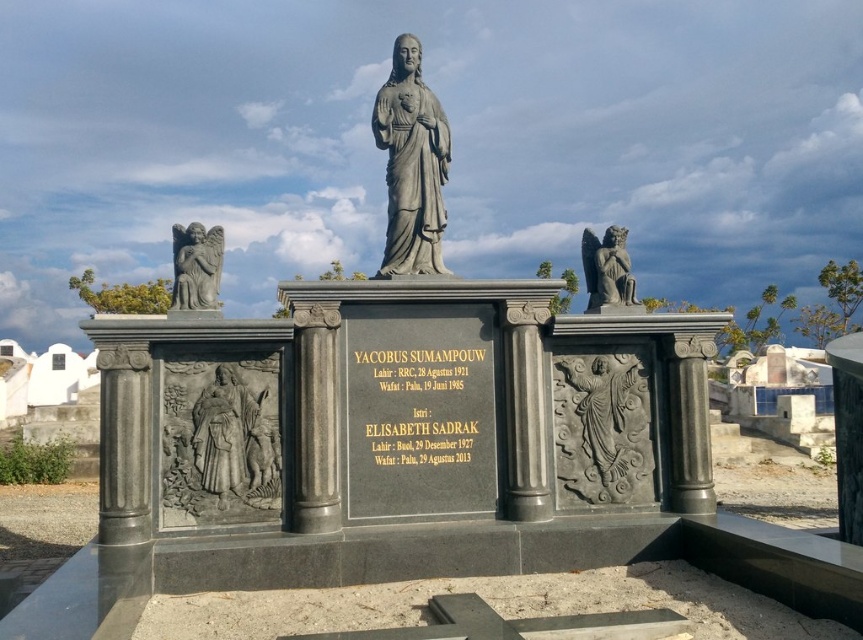
Is point (237, 401) farther from viewer compared to point (172, 237)?

No, (237, 401) is closer to viewer.

Which is in front, point (216, 374) or point (205, 248)?

Point (216, 374) is more forward.

The image size is (863, 640). What are the coordinates of `matte gray statue at lower left` in the screenshot? It's located at (230, 436).

Can you confirm if gray stone statue at center is smaller than slate gray stone angel at upper right?

Yes, gray stone statue at center is smaller than slate gray stone angel at upper right.

Who is lower down, gray stone statue at center or slate gray stone angel at upper right?

gray stone statue at center

This screenshot has width=863, height=640. In order to click on gray stone statue at center in this screenshot , I will do `click(411, 164)`.

Locate an element on the screen. Image resolution: width=863 pixels, height=640 pixels. gray stone statue at center is located at coordinates (411, 164).

What are the coordinates of `gray stone statue at center` in the screenshot? It's located at (411, 164).

Who is lower down, gray stone statue at center or matte gray statue at lower left?

Positioned lower is matte gray statue at lower left.

Who is more forward, (386,97) or (237,472)?

Point (237,472)

Where is `gray stone statue at center`? gray stone statue at center is located at coordinates (411, 164).